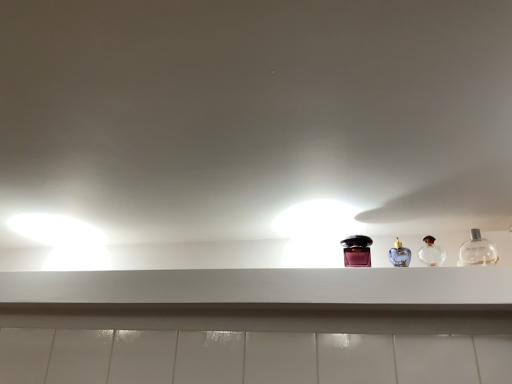
Find the location of a particular element. The width and height of the screenshot is (512, 384). clear glass perfume at center right, placed as the 2th bottle when sorted from left to right is located at coordinates (431, 252).

At what (x,y) coordinates should I click in order to perform the action: click on shiny purple bottle at center, positioned as the third bottle in right-to-left order. Please return your answer as a coordinate pair (x, y). The height and width of the screenshot is (384, 512). Looking at the image, I should click on (357, 251).

The width and height of the screenshot is (512, 384). What do you see at coordinates (264, 286) in the screenshot? I see `white matte shelf at center` at bounding box center [264, 286].

Where is `white matte shelf at center`? This screenshot has width=512, height=384. white matte shelf at center is located at coordinates (264, 286).

This screenshot has height=384, width=512. I want to click on clear glass perfume at center right, the second bottle viewed from the right, so click(431, 252).

Does point (351, 246) come farther from viewer compared to point (474, 241)?

Yes, it is behind point (474, 241).

Is shiny purple bottle at center, positioned as the third bottle in right-to-left order, positioned in front of clear glass bottle at right, which is the 1th bottle in right-to-left order?

No, the depth of shiny purple bottle at center, positioned as the third bottle in right-to-left order, is greater than that of clear glass bottle at right, which is the 1th bottle in right-to-left order.

From a real-world perspective, which object stands above the other?

In real-world perspective, shiny purple bottle at center, positioned as the 1th bottle in left-to-right order, is above.

Which of these two, shiny purple bottle at center, positioned as the third bottle in right-to-left order, or clear glass bottle at right, which is the 1th bottle in right-to-left order, is wider?

shiny purple bottle at center, positioned as the third bottle in right-to-left order, is wider.

Where is `bottle that is the 2nd object above the white matte shelf at center (from a real-world perspective)`? The image size is (512, 384). bottle that is the 2nd object above the white matte shelf at center (from a real-world perspective) is located at coordinates (431, 252).

Visually, is clear glass perfume at center right, placed as the 2th bottle when sorted from left to right, positioned to the left or to the right of white matte shelf at center?

clear glass perfume at center right, placed as the 2th bottle when sorted from left to right, is positioned on white matte shelf at center's right side.

Would you consider clear glass perfume at center right, placed as the 2th bottle when sorted from left to right, to be distant from white matte shelf at center?

No, clear glass perfume at center right, placed as the 2th bottle when sorted from left to right, is in close proximity to white matte shelf at center.

From a real-world perspective, is clear glass perfume at center right, placed as the 2th bottle when sorted from left to right, positioned above or below white matte shelf at center?

In terms of real-world spatial position, clear glass perfume at center right, placed as the 2th bottle when sorted from left to right, is above white matte shelf at center.

From the image's perspective, is clear glass perfume at center right, placed as the 2th bottle when sorted from left to right, below clear glass bottle at right, which is the 1th bottle in right-to-left order?

Yes, from the image's perspective, clear glass perfume at center right, placed as the 2th bottle when sorted from left to right, is below clear glass bottle at right, which is the 1th bottle in right-to-left order.

Image resolution: width=512 pixels, height=384 pixels. Identify the location of bottle on the right of the clear glass perfume at center right, the second bottle viewed from the right. (477, 251).

Is clear glass perfume at center right, placed as the 2th bottle when sorted from left to right, situated inside clear glass bottle at right, the 3th bottle viewed from the left, or outside?

clear glass perfume at center right, placed as the 2th bottle when sorted from left to right, exists outside the volume of clear glass bottle at right, the 3th bottle viewed from the left.

Which is closer, (428, 252) or (490, 263)?

Clearly, point (428, 252) is more distant from the camera than point (490, 263).

Measure the distance between clear glass bottle at right, which is the 1th bottle in right-to-left order, and shiny purple bottle at center, positioned as the third bottle in right-to-left order.

clear glass bottle at right, which is the 1th bottle in right-to-left order, and shiny purple bottle at center, positioned as the third bottle in right-to-left order, are 11.01 inches apart.

Between clear glass bottle at right, the 3th bottle viewed from the left, and shiny purple bottle at center, positioned as the 1th bottle in left-to-right order, which one has less height?

clear glass bottle at right, the 3th bottle viewed from the left.

Can you confirm if clear glass bottle at right, which is the 1th bottle in right-to-left order, is positioned to the left of shiny purple bottle at center, positioned as the third bottle in right-to-left order?

No.

Based on the photo, how many degrees apart are the facing directions of clear glass bottle at right, which is the 1th bottle in right-to-left order, and shiny purple bottle at center, positioned as the 1th bottle in left-to-right order?

clear glass bottle at right, which is the 1th bottle in right-to-left order, and shiny purple bottle at center, positioned as the 1th bottle in left-to-right order, are facing 0.00116 degrees away from each other.

In terms of height, does white matte shelf at center look taller or shorter compared to clear glass bottle at right, the 3th bottle viewed from the left?

Considering their sizes, white matte shelf at center has less height than clear glass bottle at right, the 3th bottle viewed from the left.

Measure the distance between white matte shelf at center and clear glass bottle at right, which is the 1th bottle in right-to-left order.

white matte shelf at center and clear glass bottle at right, which is the 1th bottle in right-to-left order, are 18.37 inches apart.

Between white matte shelf at center and clear glass bottle at right, which is the 1th bottle in right-to-left order, which one has smaller width?

clear glass bottle at right, which is the 1th bottle in right-to-left order.

Choose the correct answer: Is white matte shelf at center inside clear glass bottle at right, which is the 1th bottle in right-to-left order, or outside it?

The correct answer is: outside.

From the image's perspective, which one is positioned higher, clear glass perfume at center right, the second bottle viewed from the right, or shiny purple bottle at center, positioned as the third bottle in right-to-left order?

clear glass perfume at center right, the second bottle viewed from the right, appears higher in the image.

In order to click on bottle on the left of clear glass perfume at center right, the second bottle viewed from the right in this screenshot , I will do `click(357, 251)`.

Is clear glass perfume at center right, the second bottle viewed from the right, next to shiny purple bottle at center, positioned as the third bottle in right-to-left order?

clear glass perfume at center right, the second bottle viewed from the right, and shiny purple bottle at center, positioned as the third bottle in right-to-left order, are clearly separated.

Is clear glass perfume at center right, placed as the 2th bottle when sorted from left to right, inside or outside of shiny purple bottle at center, positioned as the third bottle in right-to-left order?

clear glass perfume at center right, placed as the 2th bottle when sorted from left to right, cannot be found inside shiny purple bottle at center, positioned as the third bottle in right-to-left order.

Looking at this image, from a real-world perspective, relative to white matte shelf at center, is clear glass bottle at right, the 3th bottle viewed from the left, vertically above or below?

clear glass bottle at right, the 3th bottle viewed from the left, is situated higher than white matte shelf at center in the real world.

Is clear glass bottle at right, which is the 1th bottle in right-to-left order, not inside white matte shelf at center?

Absolutely, clear glass bottle at right, which is the 1th bottle in right-to-left order, is external to white matte shelf at center.

Is clear glass bottle at right, which is the 1th bottle in right-to-left order, wider or thinner than white matte shelf at center?

clear glass bottle at right, which is the 1th bottle in right-to-left order, is thinner than white matte shelf at center.

Who is smaller, clear glass bottle at right, the 3th bottle viewed from the left, or white matte shelf at center?

clear glass bottle at right, the 3th bottle viewed from the left, is smaller.

Image resolution: width=512 pixels, height=384 pixels. I want to click on bottle that is the 2nd object to the left of the clear glass bottle at right, which is the 1th bottle in right-to-left order, starting at the anchor, so click(x=357, y=251).

You are a GUI agent. You are given a task and a screenshot of the screen. Output one action in this format:
    pyautogui.click(x=<x>, y=<y>)
    Task: Click on the window sill below the clear glass perfume at center right, the second bottle viewed from the right (from the image's perspective)
    This screenshot has height=384, width=512.
    Given the screenshot: What is the action you would take?
    pyautogui.click(x=264, y=286)

Looking at this image, when comparing their distances from clear glass bottle at right, the 3th bottle viewed from the left, does white matte shelf at center or shiny purple bottle at center, positioned as the third bottle in right-to-left order, seem closer?

shiny purple bottle at center, positioned as the third bottle in right-to-left order.

Considering their positions, is shiny purple bottle at center, positioned as the third bottle in right-to-left order, positioned further to clear glass perfume at center right, placed as the 2th bottle when sorted from left to right, than white matte shelf at center?

Among the two, white matte shelf at center is located further to clear glass perfume at center right, placed as the 2th bottle when sorted from left to right.

Looking at the image, which one is located closer to white matte shelf at center, clear glass bottle at right, which is the 1th bottle in right-to-left order, or shiny purple bottle at center, positioned as the third bottle in right-to-left order?

Among the two, shiny purple bottle at center, positioned as the third bottle in right-to-left order, is located nearer to white matte shelf at center.

Looking at the image, which one is located closer to white matte shelf at center, clear glass perfume at center right, placed as the 2th bottle when sorted from left to right, or clear glass bottle at right, the 3th bottle viewed from the left?

The object closer to white matte shelf at center is clear glass perfume at center right, placed as the 2th bottle when sorted from left to right.

From the image, which object appears to be nearer to white matte shelf at center, shiny purple bottle at center, positioned as the 1th bottle in left-to-right order, or clear glass bottle at right, the 3th bottle viewed from the left?

shiny purple bottle at center, positioned as the 1th bottle in left-to-right order.

Considering their positions, is clear glass bottle at right, which is the 1th bottle in right-to-left order, positioned closer to clear glass perfume at center right, the second bottle viewed from the right, than shiny purple bottle at center, positioned as the third bottle in right-to-left order?

clear glass bottle at right, which is the 1th bottle in right-to-left order, lies closer to clear glass perfume at center right, the second bottle viewed from the right, than the other object.

Looking at the image, which one is located further to clear glass perfume at center right, the second bottle viewed from the right, white matte shelf at center or clear glass bottle at right, the 3th bottle viewed from the left?

white matte shelf at center is positioned further to the anchor clear glass perfume at center right, the second bottle viewed from the right.

Based on their spatial positions, is clear glass bottle at right, which is the 1th bottle in right-to-left order, or clear glass perfume at center right, the second bottle viewed from the right, closer to shiny purple bottle at center, positioned as the third bottle in right-to-left order?

Among the two, clear glass perfume at center right, the second bottle viewed from the right, is located nearer to shiny purple bottle at center, positioned as the third bottle in right-to-left order.

Identify the location of bottle located between shiny purple bottle at center, positioned as the third bottle in right-to-left order, and clear glass bottle at right, the 3th bottle viewed from the left, in the left-right direction. This screenshot has height=384, width=512. (x=431, y=252).

At what (x,y) coordinates should I click in order to perform the action: click on bottle between white matte shelf at center and clear glass perfume at center right, the second bottle viewed from the right. Please return your answer as a coordinate pair (x, y). The width and height of the screenshot is (512, 384). Looking at the image, I should click on (357, 251).